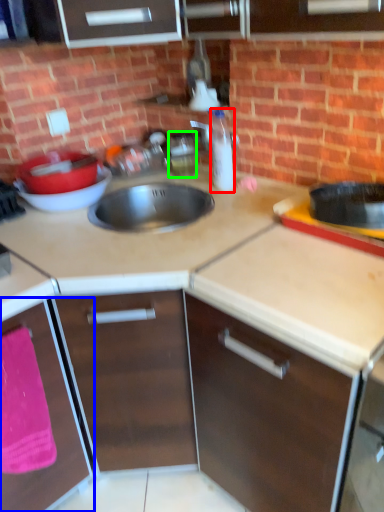
Question: Which object is the closest to the bottle (highlighted by a red box)? Choose among these: cabinetry (highlighted by a blue box) or appliance (highlighted by a green box).

Choices:
 (A) cabinetry
 (B) appliance

Answer: (B)